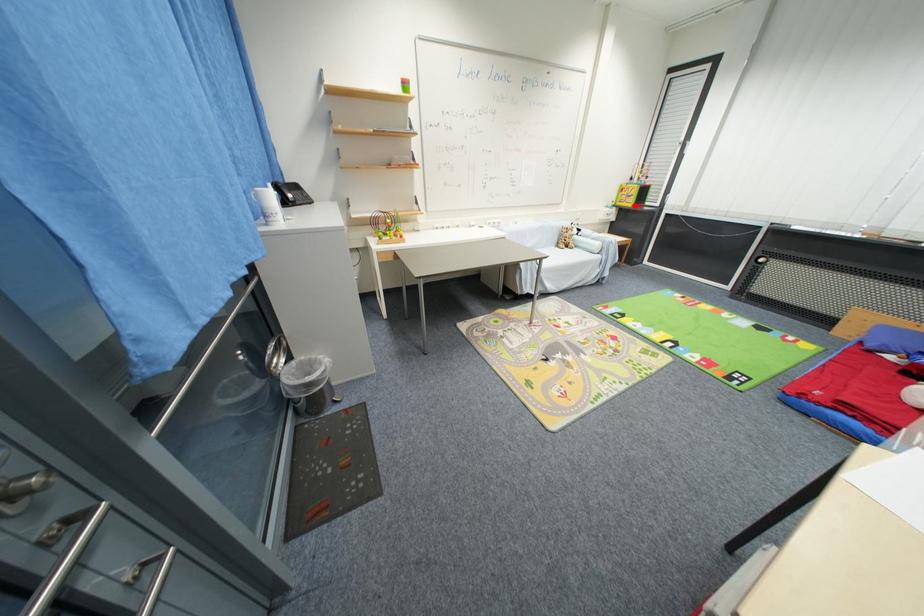
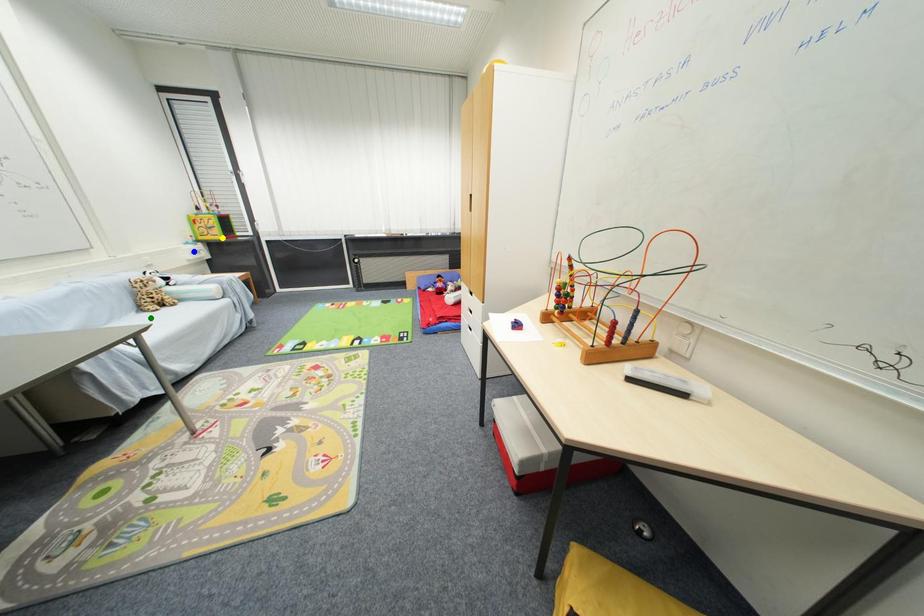
Question: I am providing you with two images of the same scene from different viewpoints. A red point is marked on the first image. You are given multiple points on the second image. In image 2, which mark is for the same physical point as the one in image 1?

Choices:
 (A) yellow point
 (B) blue point
 (C) green point

Answer: (A)